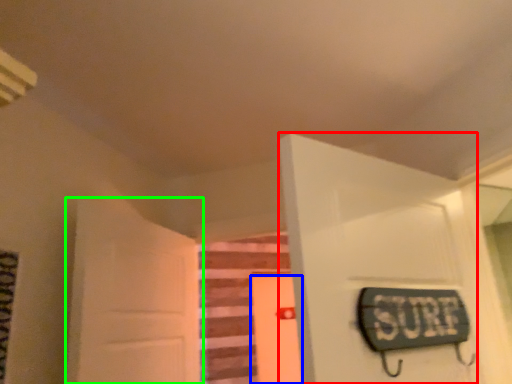
Question: Based on their relative distances, which object is farther from door (highlighted by a red box)? Choose from door (highlighted by a blue box) and door (highlighted by a green box).

Choices:
 (A) door
 (B) door

Answer: (A)